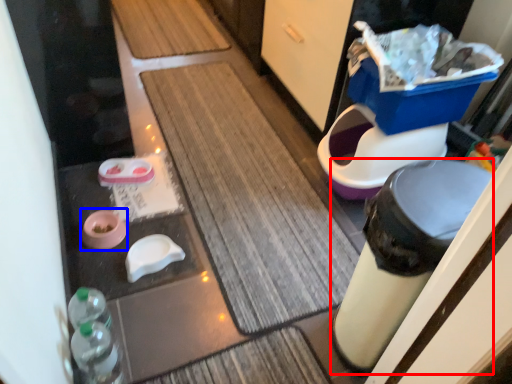
Question: Which object is closer to the camera taking this photo, trash bin/can (highlighted by a red box) or potty (highlighted by a blue box)?

Choices:
 (A) trash bin/can
 (B) potty

Answer: (A)